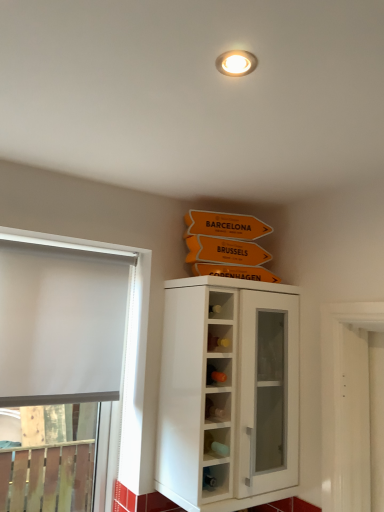
Question: Is white glossy cupboard at center inside or outside of white matte window at left?

Choices:
 (A) outside
 (B) inside

Answer: (A)

Question: From a real-world perspective, is white glossy cupboard at center positioned above or below white matte window at left?

Choices:
 (A) below
 (B) above

Answer: (B)

Question: Considering the positions of white glossy cupboard at center and white matte window at left in the image, is white glossy cupboard at center taller or shorter than white matte window at left?

Choices:
 (A) tall
 (B) short

Answer: (B)

Question: Considering the positions of white matte window at left and white glossy cupboard at center in the image, is white matte window at left wider or thinner than white glossy cupboard at center?

Choices:
 (A) thin
 (B) wide

Answer: (A)

Question: In the image, is white matte window at left positioned in front of or behind white glossy cupboard at center?

Choices:
 (A) behind
 (B) front

Answer: (A)

Question: From a real-world perspective, relative to white glossy cupboard at center, is white matte window at left vertically above or below?

Choices:
 (A) below
 (B) above

Answer: (A)

Question: Is point (89, 291) positioned closer to the camera than point (226, 490)?

Choices:
 (A) farther
 (B) closer

Answer: (A)